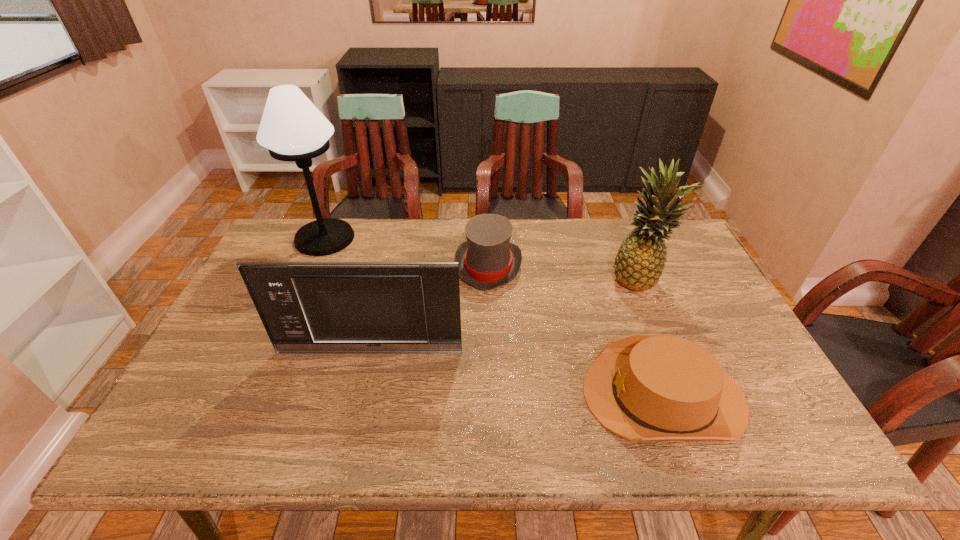
Image resolution: width=960 pixels, height=540 pixels. I want to click on free point between the cowboy hat and the dress hat, so click(576, 330).

Find the location of `unoccupied position between the third tallest object and the cowboy hat`. unoccupied position between the third tallest object and the cowboy hat is located at coordinates (516, 373).

At what (x,y) coordinates should I click in order to perform the action: click on blank region between the fourth tallest object and the tallest object. Please return your answer as a coordinate pair (x, y). Looking at the image, I should click on (406, 252).

I want to click on object that ranks as the third closest to the second shortest object, so click(x=640, y=260).

Identify the location of object that is the closest to the fourth tallest object. The width and height of the screenshot is (960, 540). (306, 307).

At what (x,y) coordinates should I click in order to perform the action: click on blank space that satisfies the following two spatial constraints: 1. on the front side of the tallest object; 2. on the left side of the fourth tallest object. Please return your answer as a coordinate pair (x, y). Looking at the image, I should click on coord(313,266).